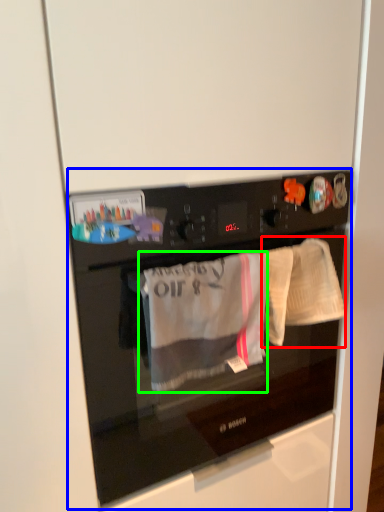
Question: Based on their relative distances, which object is nearer to baby clothe (highlighted by a red box)? Choose from home appliance (highlighted by a blue box) and clothing (highlighted by a green box).

Choices:
 (A) home appliance
 (B) clothing

Answer: (B)